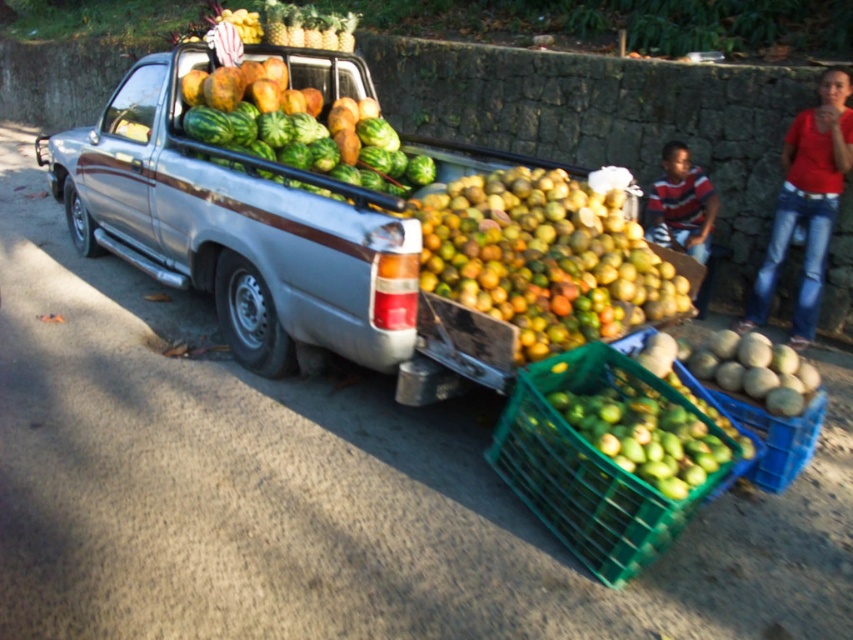
You are a customer at the farmer market and see the striped shirt at center and the green plastic crate at lower right. Which one is closer to you?

The striped shirt at center is closer to you because it is positioned further to the viewer than the green plastic crate at lower right.

What are the coordinates of the green matte melon at lower right?

The green matte melon at lower right is located at coordinates point [753,369].